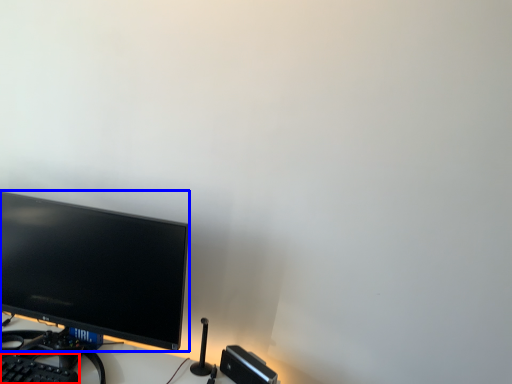
Question: Which point is further to the camera, computer keyboard (highlighted by a red box) or computer monitor (highlighted by a blue box)?

Choices:
 (A) computer keyboard
 (B) computer monitor

Answer: (B)